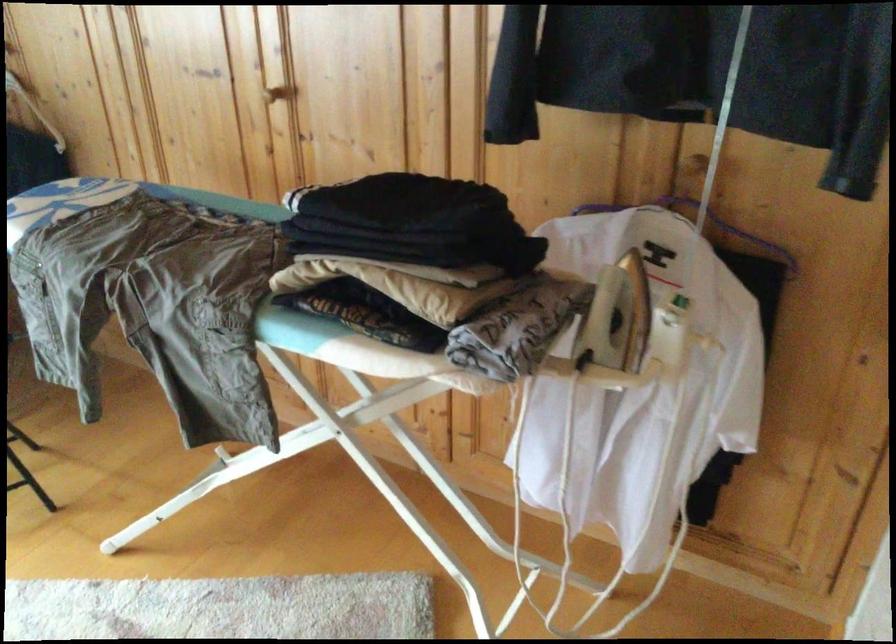
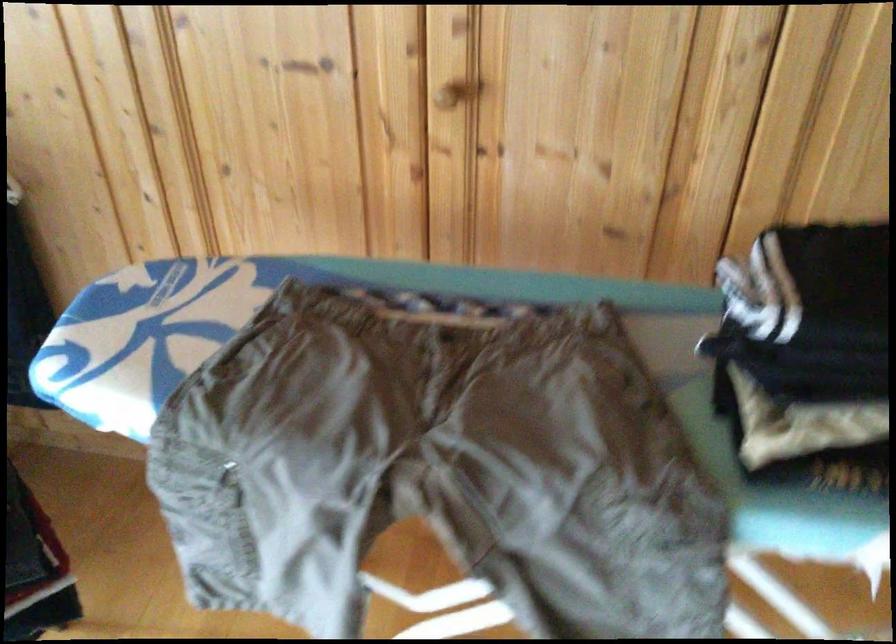
In a continuous first-person perspective shot, in which direction is the camera moving?

The cameraman moved toward left, forward.